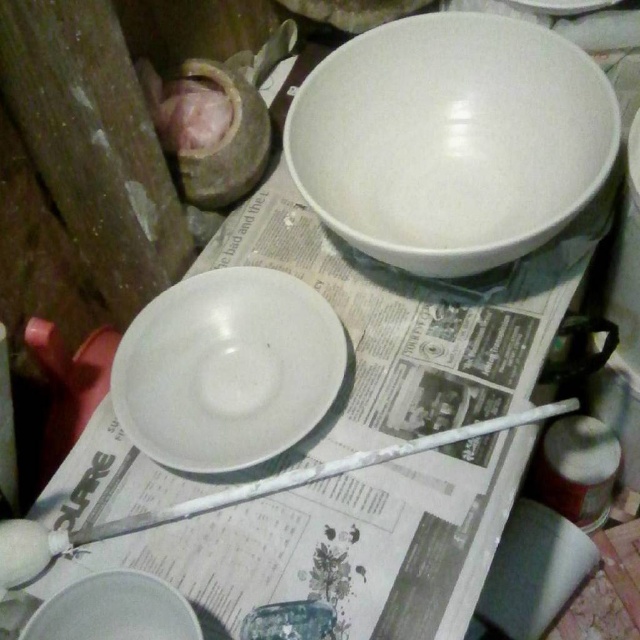
Who is shorter, white glossy bowl at upper center or matte white jar at lower right?

matte white jar at lower right is shorter.

Does white glossy bowl at upper center have a larger size compared to matte white jar at lower right?

Yes, white glossy bowl at upper center is bigger than matte white jar at lower right.

Is point (467, 257) positioned in front of point (602, 444)?

That is True.

Locate an element on the screen. The image size is (640, 640). white glossy bowl at upper center is located at coordinates (451, 140).

Can you confirm if white glossy bowl at upper center is smaller than white glossy plate at center?

No, white glossy bowl at upper center is not smaller than white glossy plate at center.

Is white glossy bowl at upper center further to camera compared to white glossy plate at center?

No.

Describe the element at coordinates (451, 140) in the screenshot. I see `white glossy bowl at upper center` at that location.

The image size is (640, 640). I want to click on white glossy bowl at upper center, so click(451, 140).

Can you confirm if white glossy plate at center is thinner than matte white bowl at lower left?

Incorrect, white glossy plate at center's width is not less than matte white bowl at lower left's.

Find the location of a particular element. This screenshot has width=640, height=640. white glossy plate at center is located at coordinates (227, 369).

Consider the image. Who is more distant from viewer, (268, 323) or (163, 608)?

Point (268, 323)

Locate an element on the screen. Image resolution: width=640 pixels, height=640 pixels. white glossy plate at center is located at coordinates (227, 369).